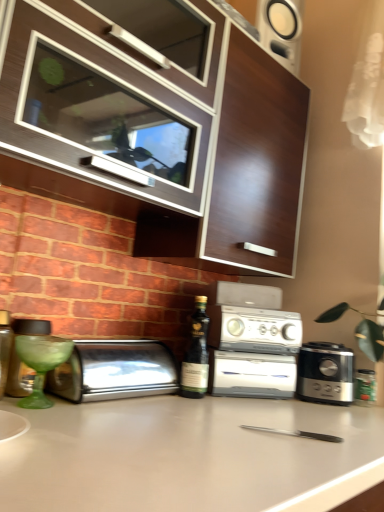
Question: Is dark green glass bottle at center spatially inside matte brown bottle at left, arranged as the second bottle when ordered from the bottom, or outside of it?

Choices:
 (A) outside
 (B) inside

Answer: (A)

Question: From their relative heights in the image, would you say dark green glass bottle at center is taller or shorter than matte brown bottle at left, the second bottle from the back?

Choices:
 (A) tall
 (B) short

Answer: (A)

Question: Considering the real-world distances, which object is closest to the green glass jar at right, which is counted as the 2th bottle, starting from the top?

Choices:
 (A) satin black coffee grinder at lower right
 (B) white plastic toaster oven at center
 (C) white matte countertop at center
 (D) wooden cabinet at upper center
 (E) matte brown bottle at left, the second bottle from the back

Answer: (A)

Question: Which object is positioned closest to the white matte countertop at center?

Choices:
 (A) satin silver toaster at lower left
 (B) satin black coffee grinder at lower right
 (C) white plastic toaster oven at center
 (D) dark green glass bottle at center
 (E) green glass jar at right, the second bottle in the front-to-back sequence

Answer: (A)